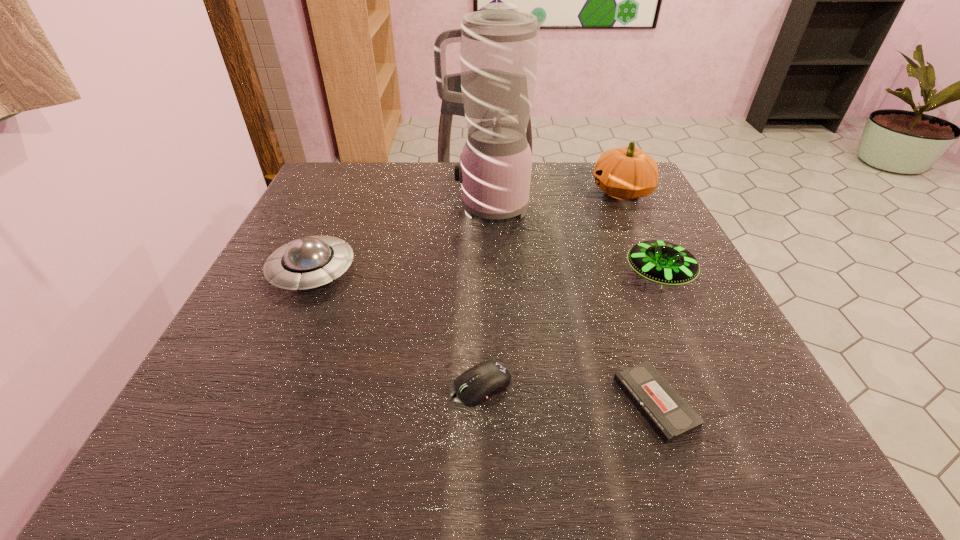
Where is `object that is positioned at the left edge`? object that is positioned at the left edge is located at coordinates (309, 262).

I want to click on gourd that is at the right edge, so click(x=625, y=173).

Find the location of a particular element. saucer at the right edge is located at coordinates (665, 263).

Locate an element on the screen. The height and width of the screenshot is (540, 960). videotape that is at the right edge is located at coordinates (669, 414).

The height and width of the screenshot is (540, 960). I want to click on object that is positioned at the far right corner, so click(625, 173).

Locate an element on the screen. The height and width of the screenshot is (540, 960). object that is at the near right corner is located at coordinates (669, 414).

The height and width of the screenshot is (540, 960). In order to click on vacant area at the far edge in this screenshot , I will do `click(412, 165)`.

Find the location of a particular element. free region at the near edge of the desktop is located at coordinates (318, 443).

Find the location of `vacant space at the left edge of the desktop`. vacant space at the left edge of the desktop is located at coordinates (289, 302).

At what (x,y) coordinates should I click in order to perform the action: click on vacant space at the right edge. Please return your answer as a coordinate pair (x, y). Looking at the image, I should click on (617, 214).